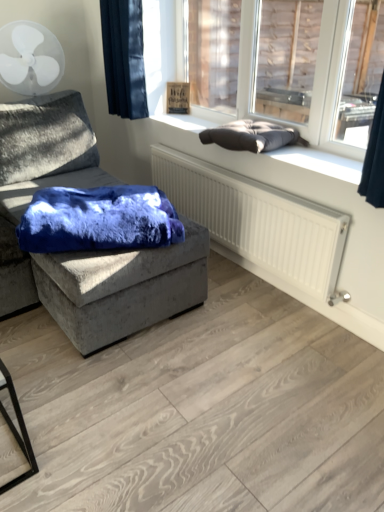
Question: Considering the relative positions of dark gray cushion at upper right and dark gray cushion at upper right in the image provided, is dark gray cushion at upper right in front of dark gray cushion at upper right?

Choices:
 (A) no
 (B) yes

Answer: (B)

Question: From a real-world perspective, is dark gray cushion at upper right under dark gray cushion at upper right?

Choices:
 (A) yes
 (B) no

Answer: (B)

Question: From a real-world perspective, is dark gray cushion at upper right over dark gray cushion at upper right?

Choices:
 (A) yes
 (B) no

Answer: (A)

Question: Is there a large distance between dark gray cushion at upper right and dark gray cushion at upper right?

Choices:
 (A) no
 (B) yes

Answer: (B)

Question: From the image's perspective, is dark gray cushion at upper right above dark gray cushion at upper right?

Choices:
 (A) no
 (B) yes

Answer: (B)

Question: Is dark gray cushion at upper right smaller than dark gray cushion at upper right?

Choices:
 (A) no
 (B) yes

Answer: (A)

Question: Is velvet gray studio couch at left at the left side of white plastic mechanical fan at upper left?

Choices:
 (A) yes
 (B) no

Answer: (B)

Question: From the image's perspective, is velvet gray studio couch at left located above white plastic mechanical fan at upper left?

Choices:
 (A) yes
 (B) no

Answer: (B)

Question: Is velvet gray studio couch at left facing away from white plastic mechanical fan at upper left?

Choices:
 (A) no
 (B) yes

Answer: (A)

Question: Is velvet gray studio couch at left next to white plastic mechanical fan at upper left?

Choices:
 (A) yes
 (B) no

Answer: (B)

Question: Is velvet gray studio couch at left at the right side of white plastic mechanical fan at upper left?

Choices:
 (A) no
 (B) yes

Answer: (B)

Question: Is velvet gray studio couch at left facing towards white plastic mechanical fan at upper left?

Choices:
 (A) no
 (B) yes

Answer: (A)

Question: Can you confirm if dark blue fabric at upper left is taller than white plastic mechanical fan at upper left?

Choices:
 (A) no
 (B) yes

Answer: (B)